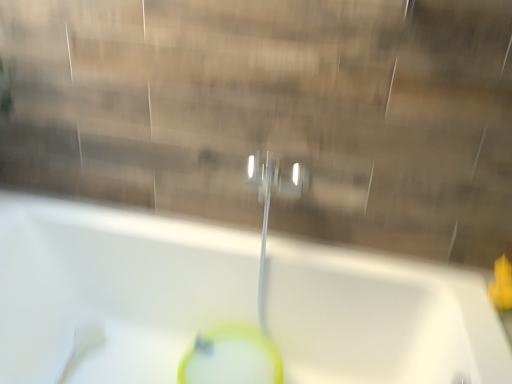
What do you see at coordinates (113, 288) in the screenshot? This screenshot has width=512, height=384. I see `white glossy bathtub at center` at bounding box center [113, 288].

Identify the location of white glossy bathtub at center. click(x=113, y=288).

Identify the location of white glossy bathtub at center. (113, 288).